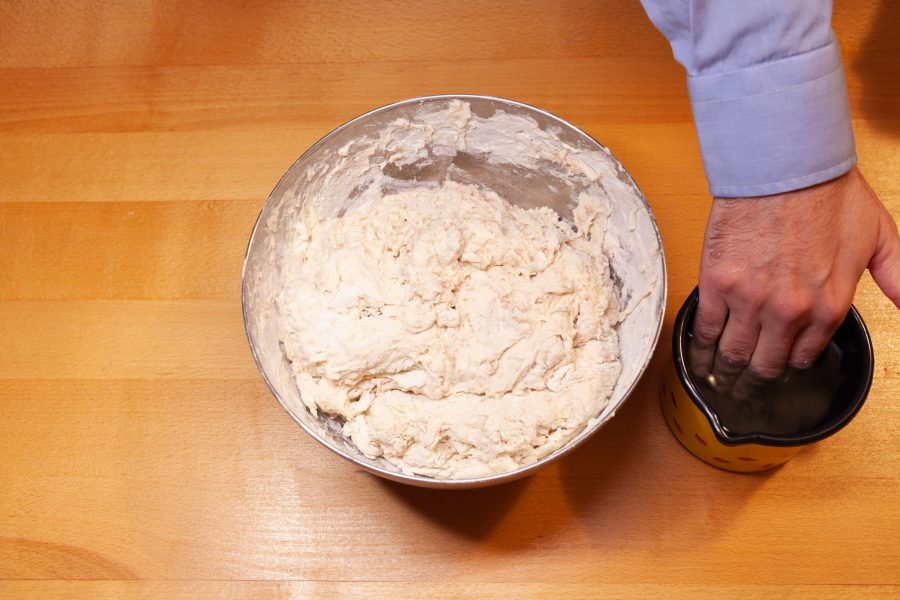
You are a GUI agent. You are given a task and a screenshot of the screen. Output one action in this format:
    pyautogui.click(x=<x>, y=<y>)
    Task: Click on the wood table
    
    Given the screenshot: What is the action you would take?
    pyautogui.click(x=114, y=299)